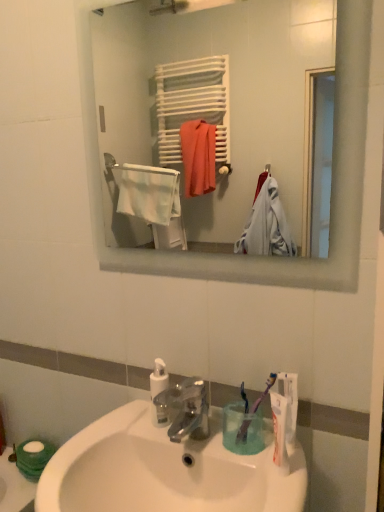
Image resolution: width=384 pixels, height=512 pixels. Identify the location of free point to the left of satin nickel faucet at center. (116, 435).